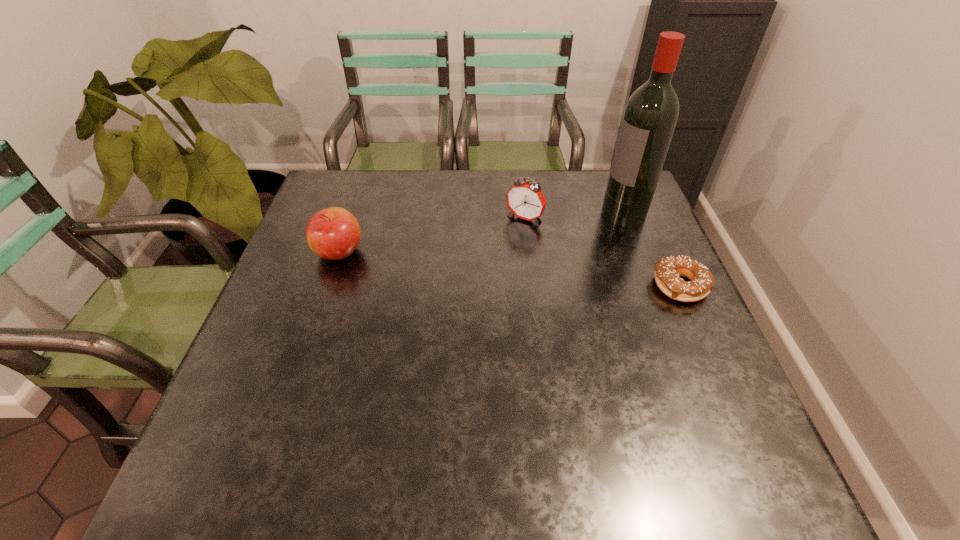
The width and height of the screenshot is (960, 540). What are the coordinates of `vacant space at the right edge` in the screenshot? It's located at (634, 249).

In the image, there is a desktop. Where is `vacant space at the far right corner`? This screenshot has width=960, height=540. vacant space at the far right corner is located at coordinates (604, 191).

Locate an element on the screen. free space at the near right corner of the desktop is located at coordinates (725, 411).

I want to click on free space that is in between the tallest object and the shortest object, so click(652, 249).

This screenshot has height=540, width=960. Identify the location of unoccupied area between the second object from left to right and the wine bottle. (574, 217).

In order to click on empty space between the leftmost object and the wine bottle in this screenshot , I will do `click(481, 233)`.

Image resolution: width=960 pixels, height=540 pixels. What are the coordinates of `free area in between the doughnut and the wine bottle` in the screenshot? It's located at (652, 249).

At what (x,y) coordinates should I click in order to perform the action: click on vacant area between the apple and the tallest object. Please return your answer as a coordinate pair (x, y). This screenshot has height=540, width=960. Looking at the image, I should click on (481, 233).

Identify the location of free space between the tallest object and the leftmost object. Image resolution: width=960 pixels, height=540 pixels. (481, 233).

This screenshot has width=960, height=540. Find the location of `free spot between the shortest object and the apple`. free spot between the shortest object and the apple is located at coordinates (510, 269).